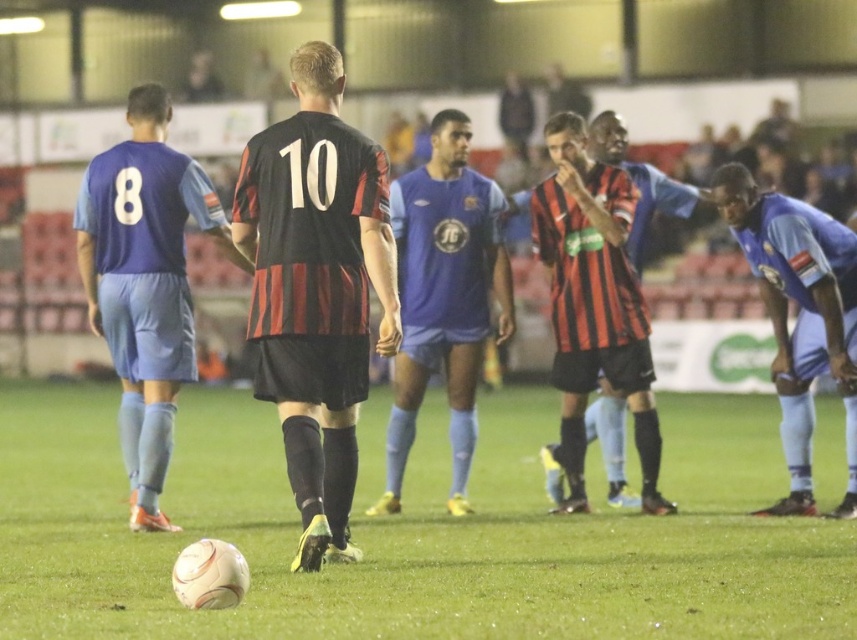
Question: Can you confirm if black and red striped jersey at center is bigger than blue jersey at right?

Choices:
 (A) no
 (B) yes

Answer: (B)

Question: Which point is closer to the camera?

Choices:
 (A) white matte football at center
 (B) black matte jersey at center

Answer: (A)

Question: Estimate the real-world distances between objects in this image. Which object is farther from the blue fabric shorts at left?

Choices:
 (A) blue jersey at right
 (B) blue jersey at center
 (C) black matte jersey at center

Answer: (A)

Question: Estimate the real-world distances between objects in this image. Which object is closer to the white matte football at center?

Choices:
 (A) black and red striped jersey at center
 (B) blue jersey at center
 (C) blue jersey at right

Answer: (A)

Question: Is blue fabric shorts at left wider than blue jersey at right?

Choices:
 (A) yes
 (B) no

Answer: (A)

Question: Considering the relative positions of white matte football at center and blue jersey at center in the image provided, where is white matte football at center located with respect to blue jersey at center?

Choices:
 (A) left
 (B) right

Answer: (A)